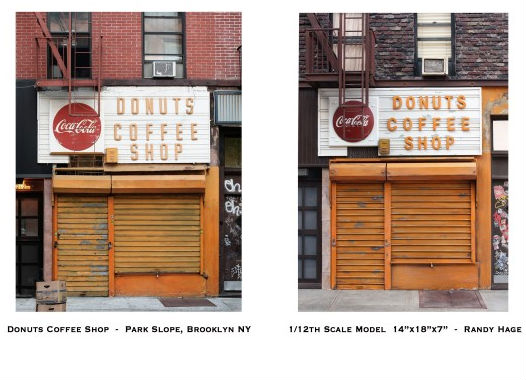
Find the location of a particular element. The width and height of the screenshot is (526, 380). door is located at coordinates (315, 219), (313, 233).